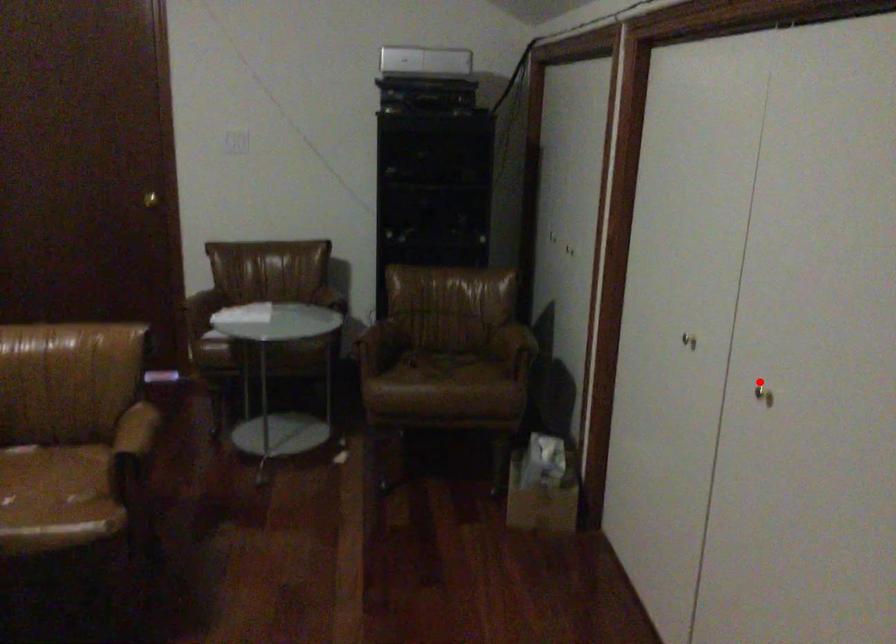
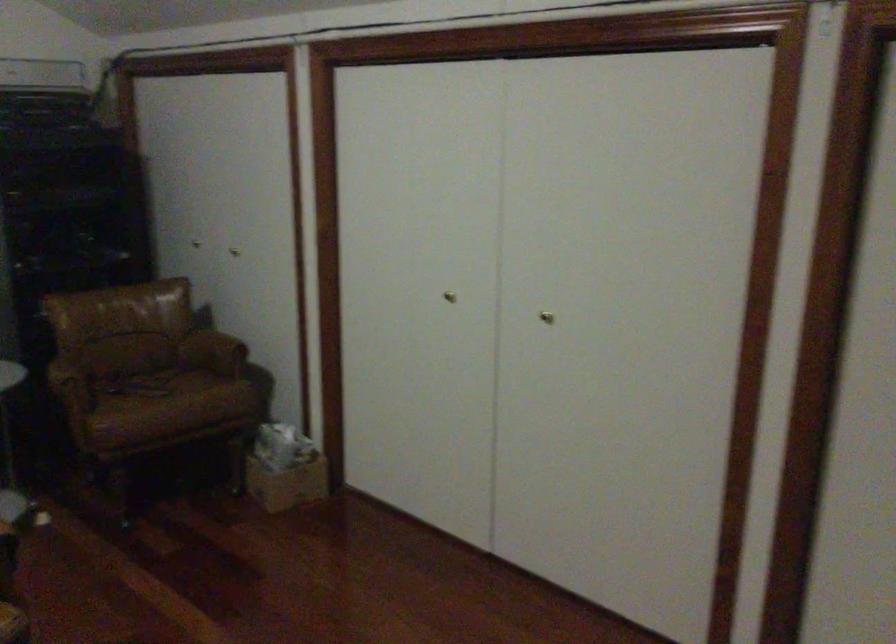
Locate, in the second image, the point that corresponds to the highlighted location in the first image.

(546, 317)